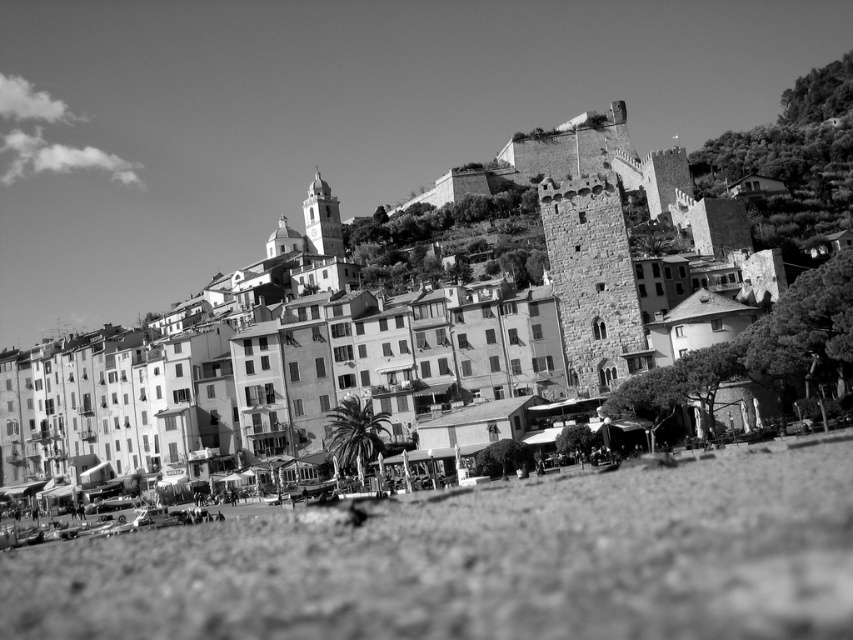
Question: Does gravelly sand at lower center appear under rough stone tower at center?

Choices:
 (A) yes
 (B) no

Answer: (A)

Question: Among these objects, which one is nearest to the camera?

Choices:
 (A) smooth stone tower at upper center
 (B) rough stone tower at center

Answer: (B)

Question: Is gravelly sand at lower center further to the viewer compared to smooth stone tower at upper center?

Choices:
 (A) no
 (B) yes

Answer: (A)

Question: Which of the following is the closest to the observer?

Choices:
 (A) (305, 221)
 (B) (801, 468)

Answer: (B)

Question: From the image, what is the correct spatial relationship of rough stone tower at center in relation to smooth stone tower at upper center?

Choices:
 (A) below
 (B) above

Answer: (A)

Question: Among these points, which one is farthest from the camera?

Choices:
 (A) (624, 253)
 (B) (39, 602)
 (C) (332, 214)

Answer: (C)